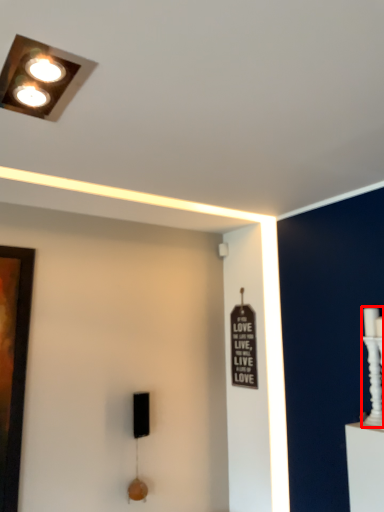
Question: From the image's perspective, what is the correct spatial positioning of candle holder (annotated by the red box) in reference to lamp?

Choices:
 (A) above
 (B) below

Answer: (B)